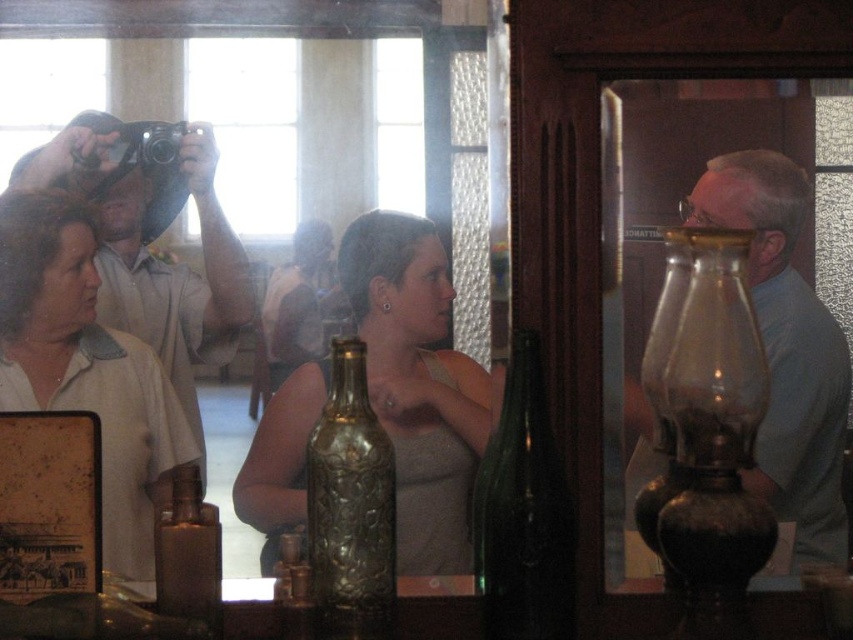
Based on the photo, you are a photographer visiting the museum and want to take a picture of the gold textured bottle at center without the matte black camera at upper left appearing in the shot. Is this possible given their positions?

The matte black camera at upper left is positioned over the gold textured bottle at center, so it would block the view. Therefore, you cannot take a picture of the gold textured bottle at center without the matte black camera at upper left appearing in the shot.

You are standing in the museum, and you want to take a photo of the matte gold bottle at center without getting too close. If your camera can focus on objects up to 5 feet away, will you be able to capture a clear photo from your current position?

The matte gold bottle at center is 5.01 feet away from the viewer. Since your camera can focus up to 5 feet, you are slightly too far to capture a clear photo. Move a tiny bit closer to ensure the bottle is within the 5 feet range for proper focus.

Based on the photo, you are a visitor in the museum and want to take a photo of the display case without anyone blocking your view. The matte blue shirt at right and the matte black camera at upper left are in your line of sight. Which object should you move out of the way first to get an unobstructed view?

You should move the matte blue shirt at right first because it is positioned to the right of the matte black camera at upper left, meaning it is closer to your line of sight and blocking the view more directly.